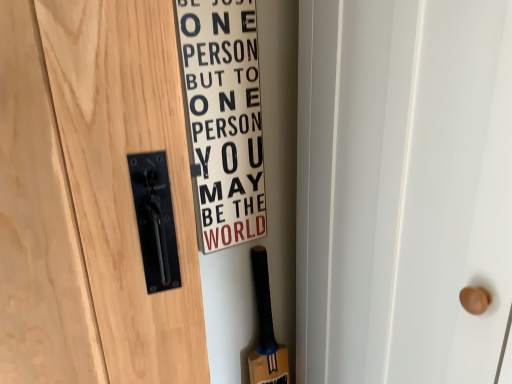
Question: Considering the positions of white matte sign at center and black rubber baseball bat at lower right in the image, is white matte sign at center wider or thinner than black rubber baseball bat at lower right?

Choices:
 (A) wide
 (B) thin

Answer: (B)

Question: In the image, is white matte sign at center on the left side or the right side of black rubber baseball bat at lower right?

Choices:
 (A) right
 (B) left

Answer: (B)

Question: From a real-world perspective, is white matte sign at center physically located above or below black rubber baseball bat at lower right?

Choices:
 (A) above
 (B) below

Answer: (A)

Question: From a real-world perspective, is black rubber baseball bat at lower right positioned above or below white matte sign at center?

Choices:
 (A) above
 (B) below

Answer: (B)

Question: In terms of height, does black rubber baseball bat at lower right look taller or shorter compared to white matte sign at center?

Choices:
 (A) tall
 (B) short

Answer: (B)

Question: In terms of size, does black rubber baseball bat at lower right appear bigger or smaller than white matte sign at center?

Choices:
 (A) big
 (B) small

Answer: (A)

Question: Does point (276, 382) appear closer or farther from the camera than point (245, 201)?

Choices:
 (A) farther
 (B) closer

Answer: (A)